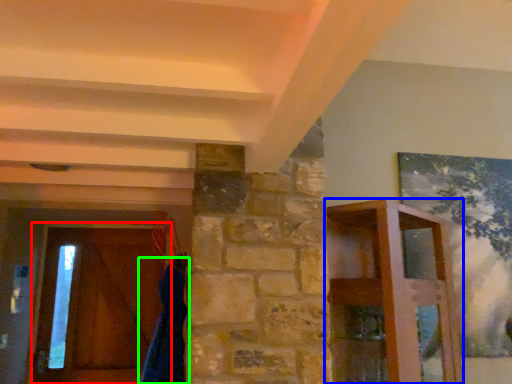
Question: Considering the real-world distances, which object is farthest from barn door (highlighted by a red box)? furniture (highlighted by a blue box) or robe (highlighted by a green box)?

Choices:
 (A) furniture
 (B) robe

Answer: (A)